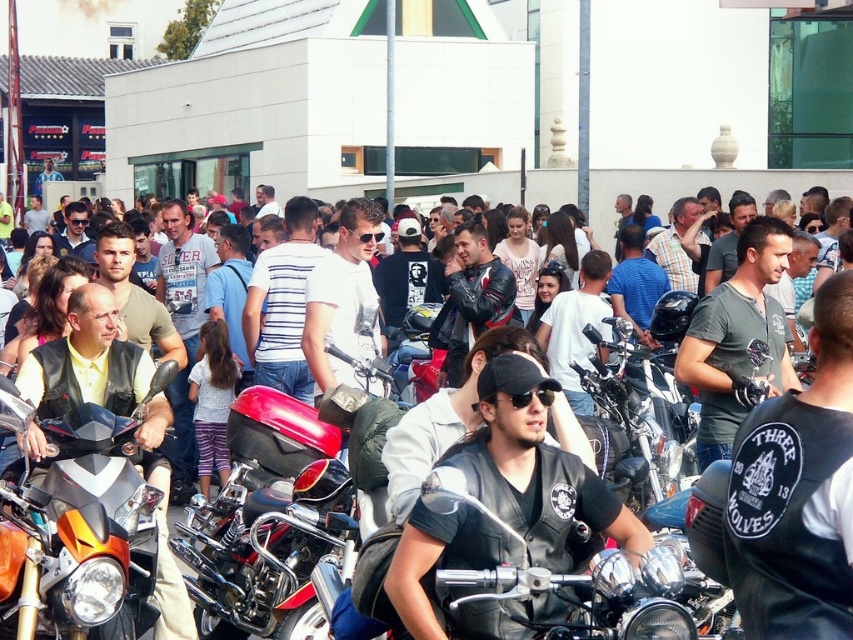
You are a photographer standing at the camera position. You want to take a photo of the orange matte motorcycle at center. However, your camera has a maximum focus range of 25 meters. Will you be able to focus on the motorcycle?

The orange matte motorcycle at center is 26.19 meters away from camera, which exceeds the camera maximum focus range of 25 meters. Therefore, the camera cannot focus on the motorcycle.

You are standing at the point with coordinates point (80, 538). You want to move to the point with coordinates point (273, 493). Is there a clear path between these two points?

Point (273, 493) is behind point (80, 538), so there is no clear path between them because the point (273, 493) is obstructed by the point (80, 538).

Consider the image. You are a photographer at the event and want to take a picture of the leather jacket at center. You notice a point with coordinates (x=502, y=509). Is this point located on the leather jacket at center?

Yes, the point (x=502, y=509) is on the leather jacket at center.